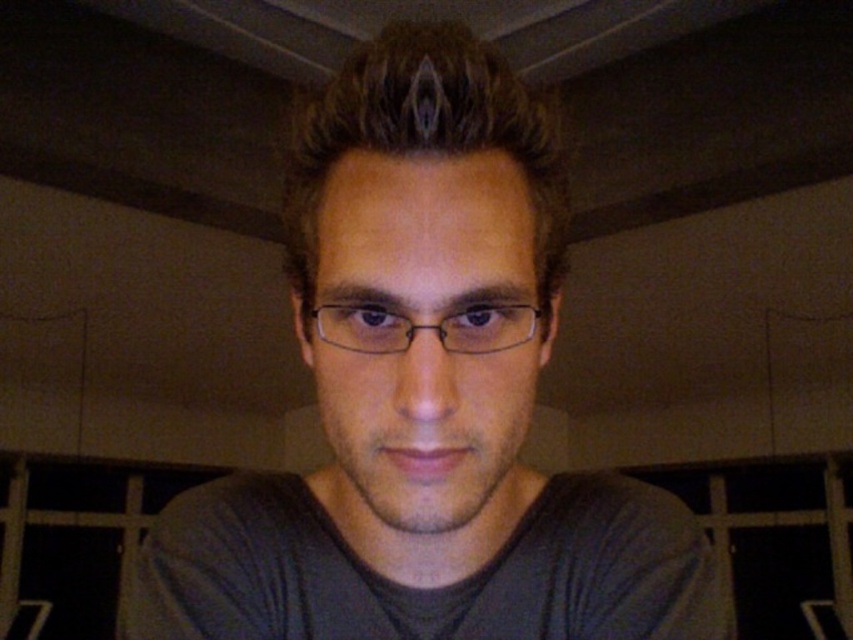
Question: Can you confirm if gray matte shirt at center is wider than brown matte hair at center?

Choices:
 (A) yes
 (B) no

Answer: (A)

Question: Does gray matte shirt at center have a lesser width compared to brown matte hair at center?

Choices:
 (A) no
 (B) yes

Answer: (A)

Question: Which point is farther to the camera?

Choices:
 (A) brown matte hair at center
 (B) clear plastic glasses at center

Answer: (B)

Question: Which is farther from the brown matte hair at center?

Choices:
 (A) clear plastic glasses at center
 (B) gray matte shirt at center

Answer: (A)

Question: Can you confirm if gray matte shirt at center is positioned below clear plastic glasses at center?

Choices:
 (A) no
 (B) yes

Answer: (B)

Question: Estimate the real-world distances between objects in this image. Which object is farther from the brown matte hair at center?

Choices:
 (A) clear plastic glasses at center
 (B) gray matte shirt at center

Answer: (A)